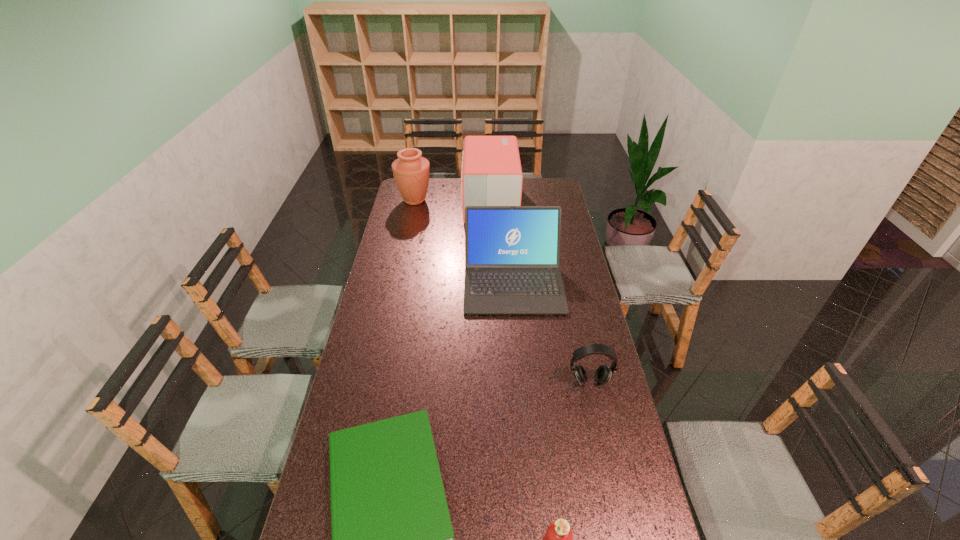
At what (x,y) coordinates should I click in order to perform the action: click on vacant space located on the ear cups of the second shortest object. Please return your answer as a coordinate pair (x, y). Looking at the image, I should click on (604, 448).

You are a GUI agent. You are given a task and a screenshot of the screen. Output one action in this format:
    pyautogui.click(x=<x>, y=<y>)
    Task: Click on the box present at the far edge
    
    Given the screenshot: What is the action you would take?
    pyautogui.click(x=491, y=175)

Locate an element on the screen. vase at the far edge is located at coordinates (411, 171).

I want to click on object that is at the left edge, so click(411, 171).

This screenshot has width=960, height=540. Find the location of `laptop computer that is positioned at the right edge`. laptop computer that is positioned at the right edge is located at coordinates (x=512, y=253).

I want to click on earphone situated at the right edge, so click(603, 373).

At what (x,y) coordinates should I click in order to perform the action: click on object at the far left corner. Please return your answer as a coordinate pair (x, y). The height and width of the screenshot is (540, 960). Looking at the image, I should click on [411, 171].

You are a GUI agent. You are given a task and a screenshot of the screen. Output one action in this format:
    pyautogui.click(x=<x>, y=<y>)
    Task: Click on the vacant region at the left edge
    The width and height of the screenshot is (960, 540).
    Given the screenshot: What is the action you would take?
    pyautogui.click(x=381, y=409)

Image resolution: width=960 pixels, height=540 pixels. I want to click on vacant space at the right edge, so click(585, 395).

This screenshot has height=540, width=960. In the image, there is a desktop. Identify the location of vacant region at the far right corner. (554, 181).